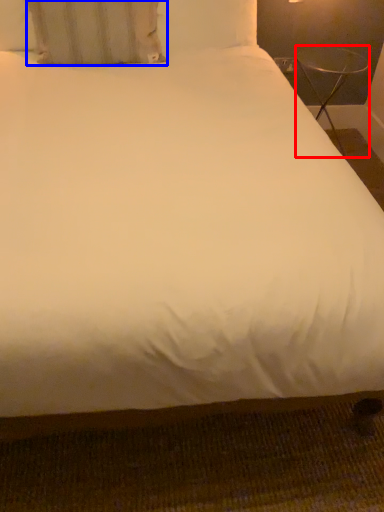
Question: Among these objects, which one is farthest to the camera, table (highlighted by a red box) or pillow (highlighted by a blue box)?

Choices:
 (A) table
 (B) pillow

Answer: (A)